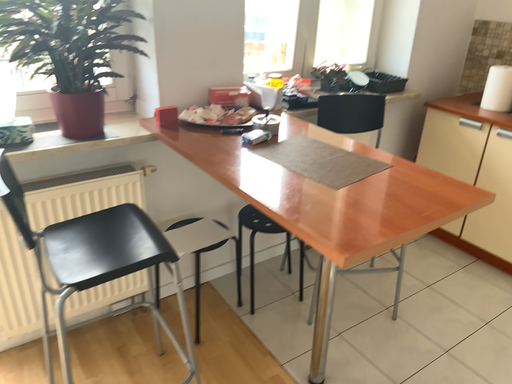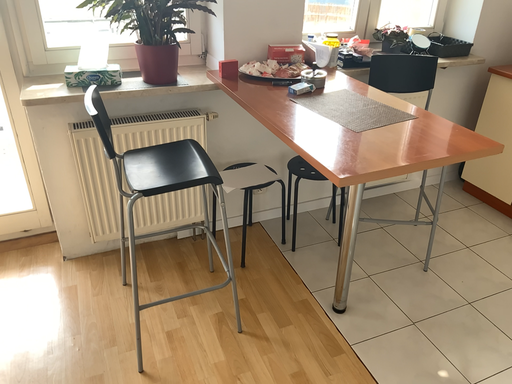
Question: How did the camera likely rotate when shooting the video?

Choices:
 (A) rotated right
 (B) rotated left

Answer: (B)